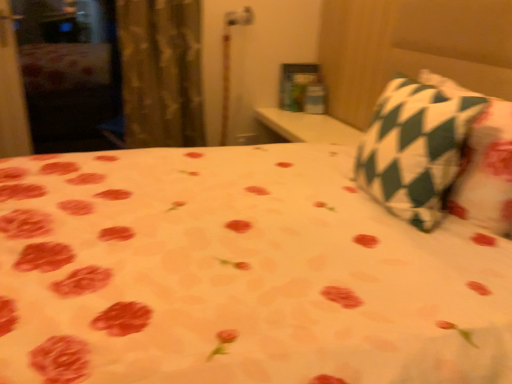
Question: Does textured beige curtain at left lie behind green checkered pillow at upper right?

Choices:
 (A) yes
 (B) no

Answer: (A)

Question: Are textured beige curtain at left and green checkered pillow at upper right beside each other?

Choices:
 (A) yes
 (B) no

Answer: (B)

Question: Is textured beige curtain at left facing towards green checkered pillow at upper right?

Choices:
 (A) yes
 (B) no

Answer: (B)

Question: Can we say textured beige curtain at left lies outside green checkered pillow at upper right?

Choices:
 (A) no
 (B) yes

Answer: (B)

Question: Is textured beige curtain at left bigger than green checkered pillow at upper right?

Choices:
 (A) yes
 (B) no

Answer: (A)

Question: Can you confirm if textured beige curtain at left is positioned to the left of green checkered pillow at upper right?

Choices:
 (A) yes
 (B) no

Answer: (A)

Question: Is green checkered pillow at upper right closer to the viewer compared to textured beige curtain at left?

Choices:
 (A) no
 (B) yes

Answer: (B)

Question: Is green checkered pillow at upper right next to textured beige curtain at left and touching it?

Choices:
 (A) no
 (B) yes

Answer: (A)

Question: From a real-world perspective, is green checkered pillow at upper right on textured beige curtain at left?

Choices:
 (A) no
 (B) yes

Answer: (B)

Question: Considering the relative sizes of green checkered pillow at upper right and textured beige curtain at left in the image provided, is green checkered pillow at upper right shorter than textured beige curtain at left?

Choices:
 (A) yes
 (B) no

Answer: (A)

Question: Considering the relative positions of green checkered pillow at upper right and textured beige curtain at left in the image provided, is green checkered pillow at upper right to the right of textured beige curtain at left from the viewer's perspective?

Choices:
 (A) no
 (B) yes

Answer: (B)

Question: Is green checkered pillow at upper right turned away from textured beige curtain at left?

Choices:
 (A) yes
 (B) no

Answer: (B)

Question: Relative to green checkered pillow at upper right, is textured beige curtain at left in front or behind?

Choices:
 (A) front
 (B) behind

Answer: (B)